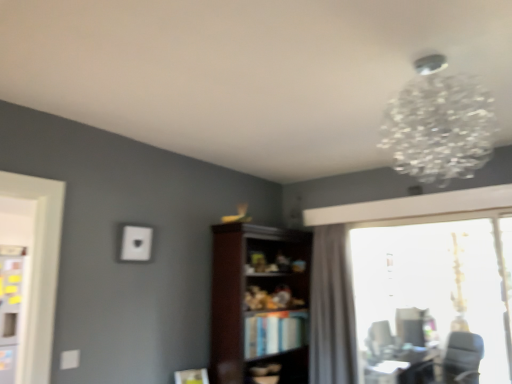
What is the approximate width of matte black swivel chair at lower right, the first swivel chair from the left?

matte black swivel chair at lower right, the first swivel chair from the left, is 4.09 inches wide.

The image size is (512, 384). I want to click on matte black swivel chair at lower right, which ranks as the 1th swivel chair in back-to-front order, so click(381, 342).

Where is `black leather swivel chair at lower right, the 1th swivel chair when ordered from right to left`? The height and width of the screenshot is (384, 512). black leather swivel chair at lower right, the 1th swivel chair when ordered from right to left is located at coordinates (462, 358).

Image resolution: width=512 pixels, height=384 pixels. I want to click on transparent glass window at right, so click(350, 264).

This screenshot has width=512, height=384. What do you see at coordinates (274, 332) in the screenshot? I see `hardcover book at center` at bounding box center [274, 332].

The image size is (512, 384). In order to click on matte black swivel chair at lower right, which ranks as the 1th swivel chair in back-to-front order in this screenshot , I will do `click(381, 342)`.

Between transparent glass window at right and matte black swivel chair at lower right, the first swivel chair from the left, which one has smaller width?

matte black swivel chair at lower right, the first swivel chair from the left.

Which is in front, transparent glass window at right or matte black swivel chair at lower right, the first swivel chair from the left?

transparent glass window at right is more forward.

Could you tell me if transparent glass window at right is turned towards matte black swivel chair at lower right, the second swivel chair in the right-to-left sequence?

No, transparent glass window at right is not facing towards matte black swivel chair at lower right, the second swivel chair in the right-to-left sequence.

Which of these two, transparent glass window at right or matte black swivel chair at lower right, the second swivel chair in the right-to-left sequence, is smaller?

matte black swivel chair at lower right, the second swivel chair in the right-to-left sequence.

Can you confirm if hardcover book at center is positioned to the right of matte black swivel chair at lower right, the first swivel chair from the left?

No.

Can you tell me how much hardcover book at center and matte black swivel chair at lower right, which ranks as the 1th swivel chair in back-to-front order, differ in facing direction?

0.625 degrees.

From a real-world perspective, between hardcover book at center and matte black swivel chair at lower right, which ranks as the 1th swivel chair in back-to-front order, who is vertically higher?

In real-world perspective, hardcover book at center is above.

Does hardcover book at center turn towards matte black swivel chair at lower right, which ranks as the 1th swivel chair in back-to-front order?

No, hardcover book at center is not aimed at matte black swivel chair at lower right, which ranks as the 1th swivel chair in back-to-front order.

You are a GUI agent. You are given a task and a screenshot of the screen. Output one action in this format:
    pyautogui.click(x=<x>, y=<y>)
    Task: Click on the window to the right of gray fabric curtain at right
    This screenshot has height=384, width=512.
    Given the screenshot: What is the action you would take?
    pyautogui.click(x=350, y=264)

Considering the points (317, 237) and (318, 368), which point is behind, point (317, 237) or point (318, 368)?

The point (317, 237) is farther.

From a real-world perspective, between transparent glass window at right and gray fabric curtain at right, who is vertically lower?

gray fabric curtain at right is physically lower.

Considering the sizes of objects transparent glass window at right and gray fabric curtain at right in the image provided, who is shorter, transparent glass window at right or gray fabric curtain at right?

Standing shorter between the two is gray fabric curtain at right.

Is transparent glass window at right at the back of matte black swivel chair at lower right, the first swivel chair from the left?

No, transparent glass window at right is not at the back of matte black swivel chair at lower right, the first swivel chair from the left.

Does matte black swivel chair at lower right, acting as the second swivel chair starting from the front, have a lesser width compared to transparent glass window at right?

Correct, the width of matte black swivel chair at lower right, acting as the second swivel chair starting from the front, is less than that of transparent glass window at right.

Which is in front, point (375, 340) or point (452, 195)?

Positioned in front is point (452, 195).

Which of these two, matte black swivel chair at lower right, the first swivel chair from the left, or transparent glass window at right, is smaller?

matte black swivel chair at lower right, the first swivel chair from the left.

Which object is thinner, hardcover book at center or black leather swivel chair at lower right, which is the 2th swivel chair from back to front?

hardcover book at center.

This screenshot has width=512, height=384. What are the coordinates of `swivel chair that is the 2nd object located below the hardcover book at center (from the image's perspective)` in the screenshot? It's located at (462, 358).

Considering the relative sizes of hardcover book at center and black leather swivel chair at lower right, which is the 2th swivel chair from back to front, in the image provided, is hardcover book at center shorter than black leather swivel chair at lower right, which is the 2th swivel chair from back to front,?

Correct, hardcover book at center is not as tall as black leather swivel chair at lower right, which is the 2th swivel chair from back to front.

Is hardcover book at center positioned beyond the bounds of black leather swivel chair at lower right, which ranks as the second swivel chair in left-to-right order?

hardcover book at center is positioned outside black leather swivel chair at lower right, which ranks as the second swivel chair in left-to-right order.

Image resolution: width=512 pixels, height=384 pixels. I want to click on the 1st swivel chair to the right of the hardcover book at center, counting from the anchor's position, so click(381, 342).

Is hardcover book at center at the back of matte black swivel chair at lower right, which ranks as the 1th swivel chair in back-to-front order?

No.

Who is more distant, matte black swivel chair at lower right, acting as the second swivel chair starting from the front, or hardcover book at center?

matte black swivel chair at lower right, acting as the second swivel chair starting from the front, is more distant.

Can you confirm if matte black swivel chair at lower right, the second swivel chair in the right-to-left sequence, is taller than hardcover book at center?

Yes, matte black swivel chair at lower right, the second swivel chair in the right-to-left sequence, is taller than hardcover book at center.

Would you say gray fabric curtain at right is a long distance from clear crystal chandelier at upper right?

Indeed, gray fabric curtain at right is not near clear crystal chandelier at upper right.

Considering the sizes of objects gray fabric curtain at right and clear crystal chandelier at upper right in the image provided, who is thinner, gray fabric curtain at right or clear crystal chandelier at upper right?

With smaller width is gray fabric curtain at right.

Which object is further away from the camera, gray fabric curtain at right or clear crystal chandelier at upper right?

gray fabric curtain at right is further away from the camera.

Which of these two, gray fabric curtain at right or clear crystal chandelier at upper right, is smaller?

clear crystal chandelier at upper right.

Identify the location of window on the left of matte black swivel chair at lower right, the first swivel chair from the left. Image resolution: width=512 pixels, height=384 pixels. tap(350, 264).

Where is `swivel chair that is the 2nd object located behind the hardcover book at center`? The height and width of the screenshot is (384, 512). swivel chair that is the 2nd object located behind the hardcover book at center is located at coordinates [381, 342].

Estimate the real-world distances between objects in this image. Which object is further from transparent glass window at right, black leather swivel chair at lower right, the 1th swivel chair when ordered from right to left, or matte black swivel chair at lower right, acting as the second swivel chair starting from the front?

black leather swivel chair at lower right, the 1th swivel chair when ordered from right to left, lies further to transparent glass window at right than the other object.

Consider the image. Which object lies nearer to the anchor point transparent glass window at right, gray fabric curtain at right or dark wood bookshelf at center?

Among the two, gray fabric curtain at right is located nearer to transparent glass window at right.

From the image, which object appears to be farther from black leather swivel chair at lower right, which ranks as the second swivel chair in left-to-right order, dark wood bookshelf at center or clear crystal chandelier at upper right?

clear crystal chandelier at upper right is positioned further to the anchor black leather swivel chair at lower right, which ranks as the second swivel chair in left-to-right order.

Estimate the real-world distances between objects in this image. Which object is further from transparent glass window at right, dark wood bookshelf at center or black leather swivel chair at lower right, the 1th swivel chair when ordered from right to left?

black leather swivel chair at lower right, the 1th swivel chair when ordered from right to left.

Estimate the real-world distances between objects in this image. Which object is further from dark wood bookshelf at center, transparent glass window at right or matte black swivel chair at lower right, the first swivel chair from the left?

Based on the image, matte black swivel chair at lower right, the first swivel chair from the left, appears to be further to dark wood bookshelf at center.

From the image, which object appears to be farther from dark wood bookshelf at center, transparent glass window at right or gray fabric curtain at right?

transparent glass window at right is positioned further to the anchor dark wood bookshelf at center.

From the image, which object appears to be nearer to black leather swivel chair at lower right, the 1th swivel chair when ordered from right to left, clear crystal chandelier at upper right or hardcover book at center?

The object closer to black leather swivel chair at lower right, the 1th swivel chair when ordered from right to left, is hardcover book at center.

Looking at this image, looking at the image, which one is located closer to matte black swivel chair at lower right, the second swivel chair in the right-to-left sequence, clear crystal chandelier at upper right or hardcover book at center?

hardcover book at center is positioned closer to the anchor matte black swivel chair at lower right, the second swivel chair in the right-to-left sequence.

At what (x,y) coordinates should I click in order to perform the action: click on swivel chair between clear crystal chandelier at upper right and matte black swivel chair at lower right, the second swivel chair in the right-to-left sequence, in the front-back direction. Please return your answer as a coordinate pair (x, y). This screenshot has width=512, height=384. Looking at the image, I should click on (462, 358).

Where is `swivel chair positioned between hardcover book at center and matte black swivel chair at lower right, which ranks as the 1th swivel chair in back-to-front order, from near to far`? swivel chair positioned between hardcover book at center and matte black swivel chair at lower right, which ranks as the 1th swivel chair in back-to-front order, from near to far is located at coordinates (462, 358).

This screenshot has width=512, height=384. Identify the location of book located between transparent glass window at right and matte black swivel chair at lower right, which ranks as the 1th swivel chair in back-to-front order, in the depth direction. (274, 332).

You are a GUI agent. You are given a task and a screenshot of the screen. Output one action in this format:
    pyautogui.click(x=<x>, y=<y>)
    Task: Click on the shelf between hardcover book at center and black leather swivel chair at lower right, placed as the 1th swivel chair when sorted from front to back
    
    Given the screenshot: What is the action you would take?
    pyautogui.click(x=259, y=302)